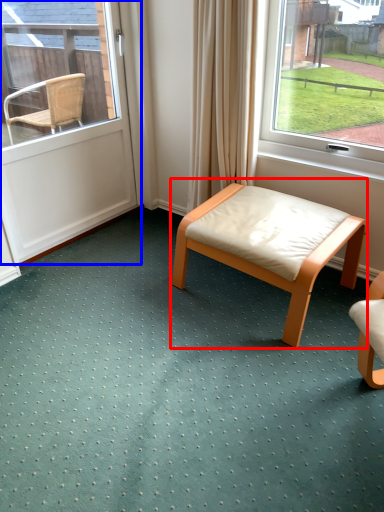
Question: Which of the following is the closest to the observer, table (highlighted by a red box) or door (highlighted by a blue box)?

Choices:
 (A) table
 (B) door

Answer: (A)